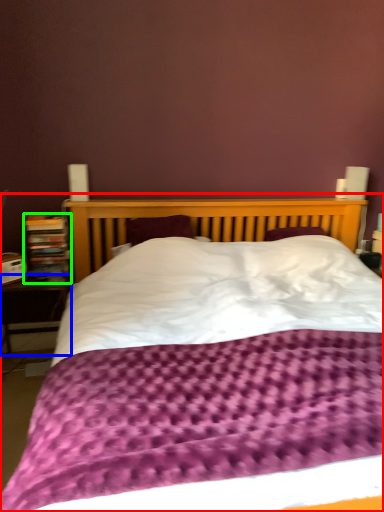
Question: Estimate the real-world distances between objects in this image. Which object is closer to bed (highlighted by a red box), table (highlighted by a blue box) or bookcase (highlighted by a green box)?

Choices:
 (A) table
 (B) bookcase

Answer: (B)